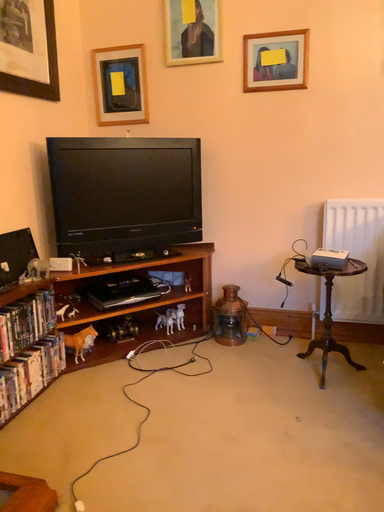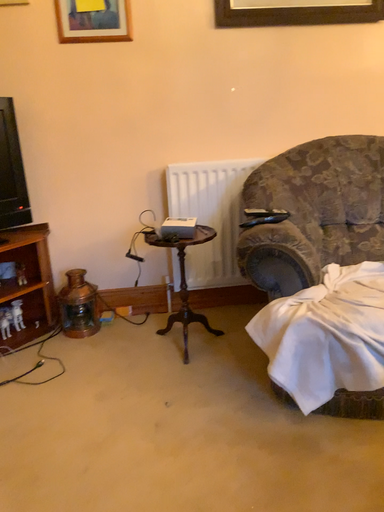
Question: How did the camera likely rotate when shooting the video?

Choices:
 (A) rotated right
 (B) rotated left

Answer: (A)